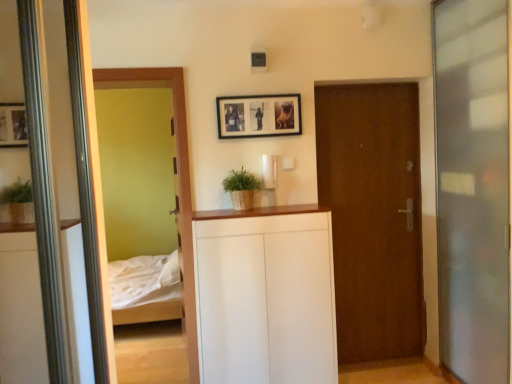
Where is `vacant region in front of braided straw plant at center`? Image resolution: width=512 pixels, height=384 pixels. vacant region in front of braided straw plant at center is located at coordinates (238, 213).